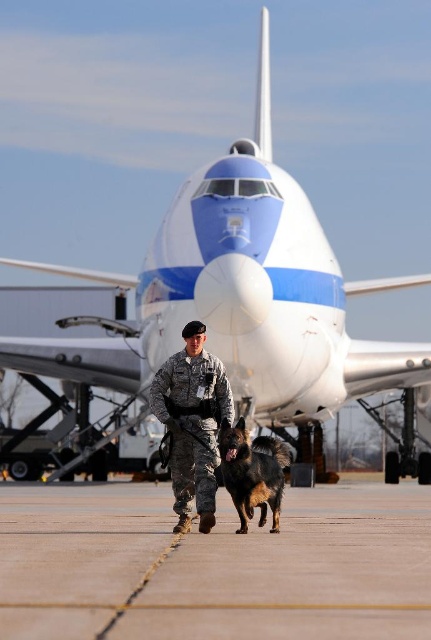
Question: Which object appears closest to the camera in this image?

Choices:
 (A) concrete tarmac at center
 (B) black fur dog at center

Answer: (A)

Question: Among these points, which one is farthest from the camera?

Choices:
 (A) (203, 417)
 (B) (274, 468)

Answer: (A)

Question: Which of the following is the farthest from the observer?

Choices:
 (A) concrete tarmac at center
 (B) camouflage uniform at center
 (C) black fur dog at center

Answer: (B)

Question: Is concrete tarmac at center behind camouflage uniform at center?

Choices:
 (A) yes
 (B) no

Answer: (B)

Question: Is concrete tarmac at center above camouflage uniform at center?

Choices:
 (A) no
 (B) yes

Answer: (A)

Question: Can you confirm if concrete tarmac at center is positioned below camouflage uniform at center?

Choices:
 (A) no
 (B) yes

Answer: (B)